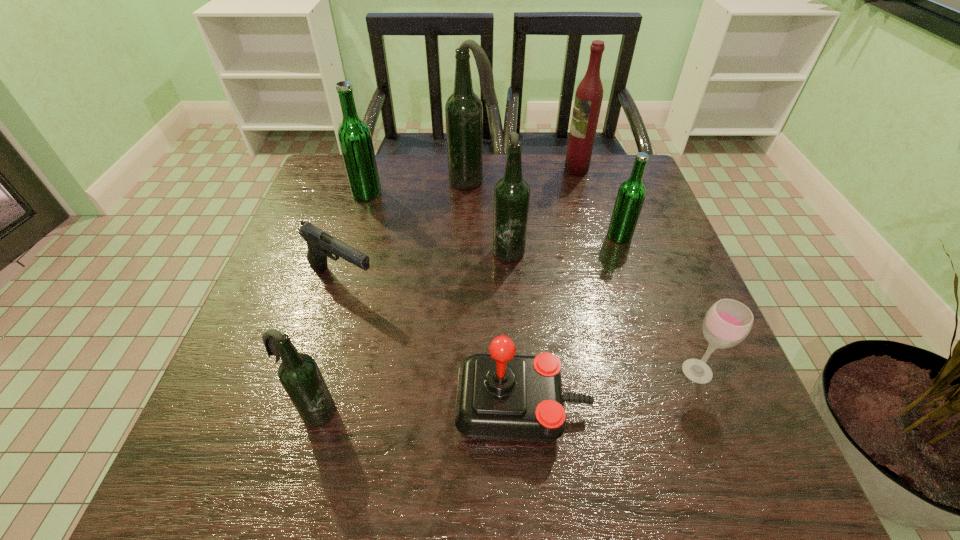
Image resolution: width=960 pixels, height=540 pixels. I want to click on empty space that is in between the second smallest dark beer bottle and the liquor, so click(x=542, y=208).

Identify the location of free space between the second nearest dark beer bottle and the rightmost beer bottle. Image resolution: width=960 pixels, height=540 pixels. (564, 242).

The image size is (960, 540). What are the coordinates of `free space that is in between the rightmost beer bottle and the biggest dark beer bottle` in the screenshot? It's located at (546, 209).

At what (x,y) coordinates should I click in order to perform the action: click on vacant area that lies between the wineglass and the joystick. Please return your answer as a coordinate pair (x, y). The height and width of the screenshot is (540, 960). Looking at the image, I should click on (610, 389).

Where is `empty space between the farther green beer bottle and the red joystick`? empty space between the farther green beer bottle and the red joystick is located at coordinates (444, 300).

Where is `free spot between the nearest dark beer bottle and the black gun`? The width and height of the screenshot is (960, 540). free spot between the nearest dark beer bottle and the black gun is located at coordinates (328, 347).

Locate an element on the screen. This screenshot has height=540, width=960. the third closest object relative to the second smallest dark beer bottle is located at coordinates (320, 244).

Identify the location of the closest object to the smallest dark beer bottle. (501, 396).

What are the coordinates of `the third closest beer bottle to the left green beer bottle` in the screenshot? It's located at (299, 374).

This screenshot has height=540, width=960. I want to click on beer bottle that is the second closest to the second smallest dark beer bottle, so click(x=631, y=194).